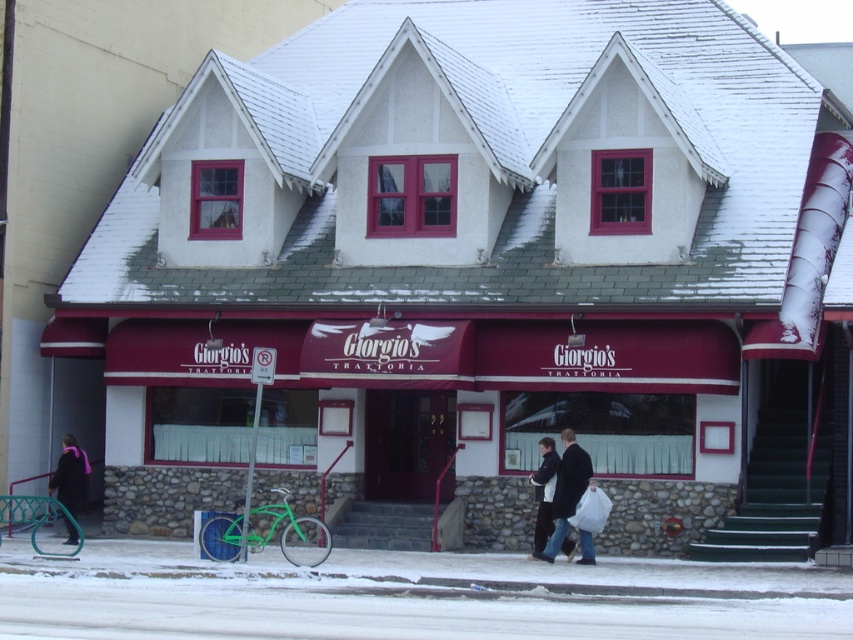
Question: Which is farther from the white snow at lower center?

Choices:
 (A) velvet purple scarf at lower left
 (B) dark gray wool coat at center

Answer: (A)

Question: Can you confirm if white snow at lower center is positioned below dark gray wool coat at center?

Choices:
 (A) yes
 (B) no

Answer: (A)

Question: Is dark gray wool coat at center below velvet purple scarf at lower left?

Choices:
 (A) no
 (B) yes

Answer: (B)

Question: Estimate the real-world distances between objects in this image. Which object is closer to the dark gray wool coat at center?

Choices:
 (A) white snow at lower center
 (B) velvet purple scarf at lower left

Answer: (A)

Question: In this image, where is white snow at lower center located relative to dark gray wool coat at center?

Choices:
 (A) right
 (B) left

Answer: (B)

Question: Which object is the farthest from the white snow at lower center?

Choices:
 (A) dark gray wool coat at center
 (B) velvet purple scarf at lower left

Answer: (B)